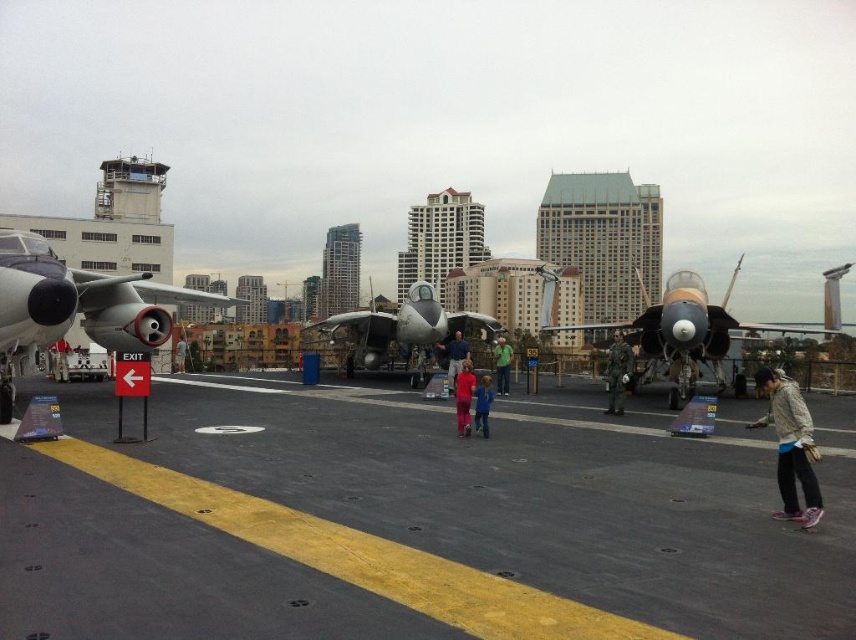
You are a pilot preparing to land your fighter jet on the aircraft carrier deck. The control tower instructs you to position your jet at the exact center of the deck. The current coordinates of the matte gray fighter jet at center are given as point 0.558, 0.533. Are you correctly aligned with the deck center?

The matte gray fighter jet at center is located at point (455, 356), which indicates it is positioned at the exact center of the deck as instructed.

Looking at this image, you are a naval officer on the aircraft carrier deck. You need to move from point A to point B, which are marked as coordinates point (470,380). The deck has yellow lines and circular markings for safety. Considering the distance between them, can you walk directly between these two points without crossing any restricted areas?

The two points point (470,380) are 10.76 meters apart. Since the deck has designated pathways marked by yellow lines and circular markings, you should follow those paths rather than walking directly between the points to avoid restricted areas.